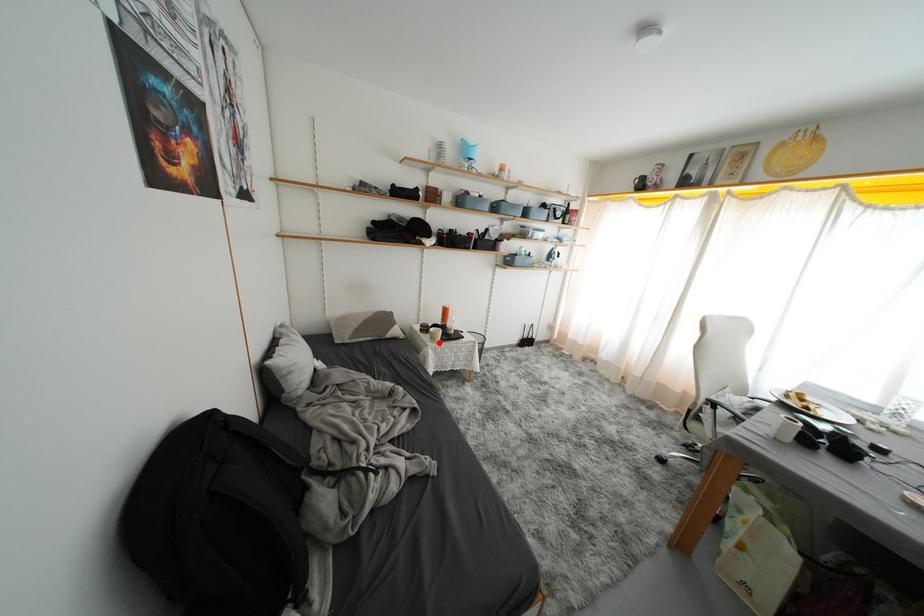
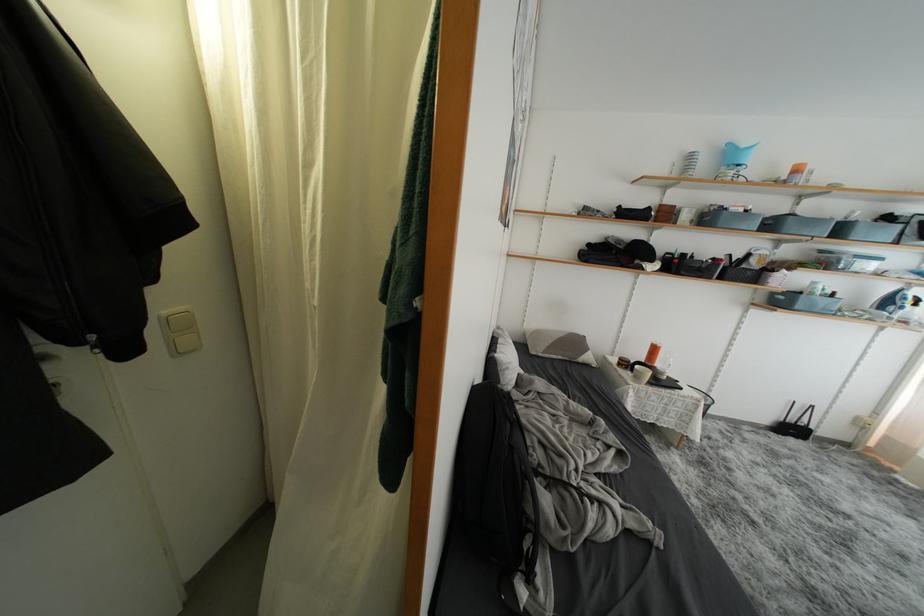
Question: A red point is marked in image1. In image2, is the corresponding 3D point closer to the camera or farther? Reply with the corresponding letter.

Choices:
 (A) The corresponding 3D point is closer.
 (B) The corresponding 3D point is farther.

Answer: (A)